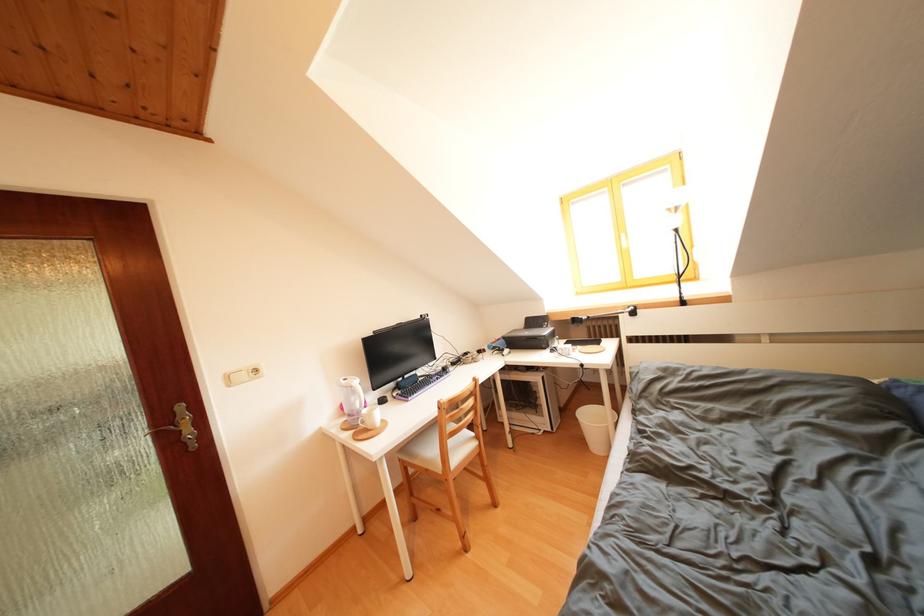
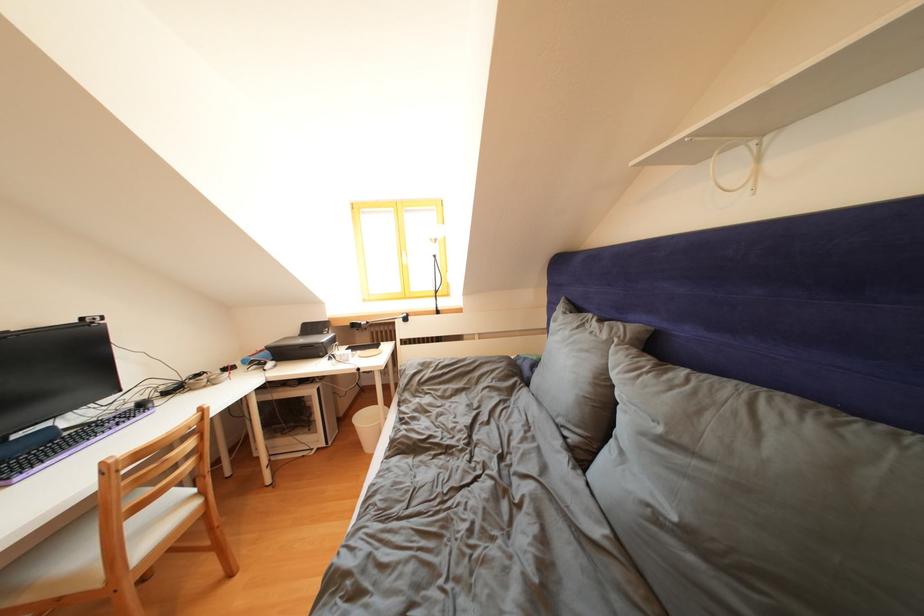
Where in the second image is the point corresponding to (596,421) from the first image?

(371, 424)